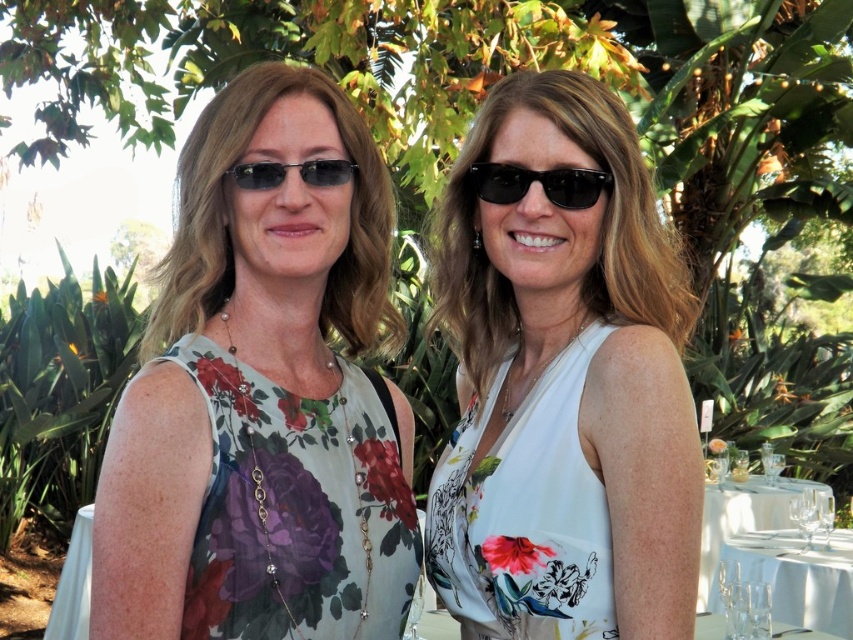
Between floral print fabric dress at left and clear glassware at lower right, which one appears on the left side from the viewer's perspective?

From the viewer's perspective, floral print fabric dress at left appears more on the left side.

The height and width of the screenshot is (640, 853). I want to click on floral print fabric dress at left, so click(299, 508).

This screenshot has width=853, height=640. I want to click on floral print fabric dress at left, so click(299, 508).

Between white floral dress at center and white glassware at lower right, which one is positioned lower?

white glassware at lower right is lower down.

Can you confirm if white floral dress at center is thinner than white glassware at lower right?

Yes, white floral dress at center is thinner than white glassware at lower right.

Between point (453, 508) and point (727, 515), which one is positioned behind?

The point (727, 515) is behind.

The image size is (853, 640). I want to click on white floral dress at center, so click(x=564, y=387).

Does white floral dress at center have a greater height compared to floral print fabric dress at left?

Indeed, white floral dress at center has a greater height compared to floral print fabric dress at left.

Is the position of white floral dress at center more distant than that of floral print fabric dress at left?

Yes, it is behind floral print fabric dress at left.

Locate an element on the screen. The height and width of the screenshot is (640, 853). white floral dress at center is located at coordinates (564, 387).